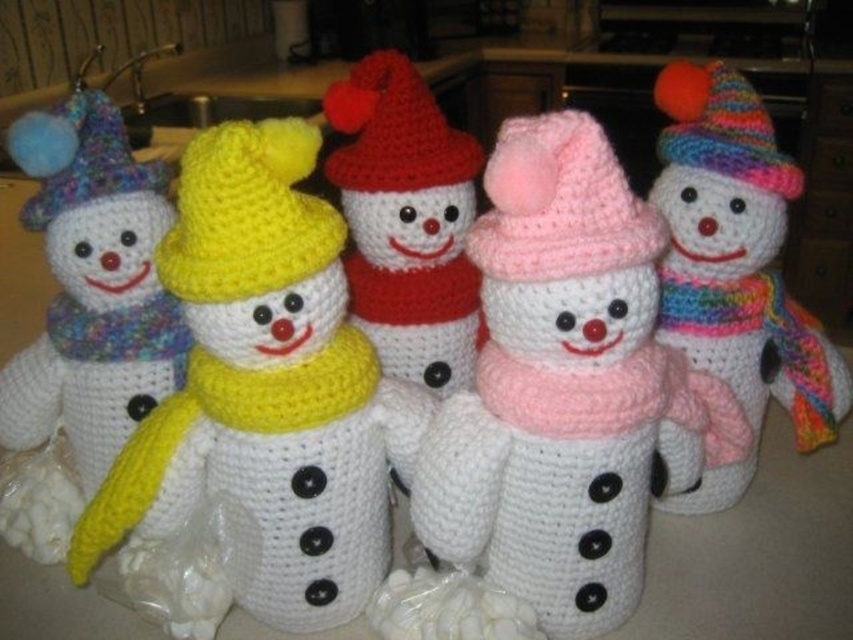
Is matte yellow yarn snowman at left bigger than pink knitted hat at center?

Yes, matte yellow yarn snowman at left is bigger than pink knitted hat at center.

Is matte yellow yarn snowman at left to the right of pink knitted hat at center from the viewer's perspective?

In fact, matte yellow yarn snowman at left is to the left of pink knitted hat at center.

Does point (138, 385) come behind point (595, 150)?

Yes, it is behind point (595, 150).

You are a GUI agent. You are given a task and a screenshot of the screen. Output one action in this format:
    pyautogui.click(x=<x>, y=<y>)
    Task: Click on the matte yellow yarn snowman at left
    The height and width of the screenshot is (640, 853).
    Given the screenshot: What is the action you would take?
    pyautogui.click(x=84, y=317)

Who is higher up, red yarn snowman at center or multicolored knitted hat at upper right?

multicolored knitted hat at upper right

Which is more to the right, red yarn snowman at center or multicolored knitted hat at upper right?

multicolored knitted hat at upper right

Between point (381, 145) and point (679, 102), which one is positioned behind?

The point (381, 145) is more distant.

Locate an element on the screen. red yarn snowman at center is located at coordinates tap(405, 220).

In order to click on matte yellow yarn snowman at left in this screenshot , I will do `click(84, 317)`.

Can you confirm if matte yellow yarn snowman at left is thinner than yellow yarn hat at center?

No.

Between point (131, 420) and point (222, 276), which one is positioned in front?

Point (222, 276) is more forward.

This screenshot has width=853, height=640. Identify the location of matte yellow yarn snowman at left. (84, 317).